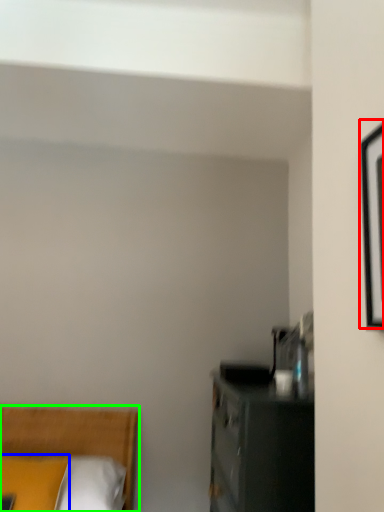
Question: Estimate the real-world distances between objects in this image. Which object is closer to picture frame (highlighted by a red box), pillow (highlighted by a blue box) or bed (highlighted by a green box)?

Choices:
 (A) pillow
 (B) bed

Answer: (A)